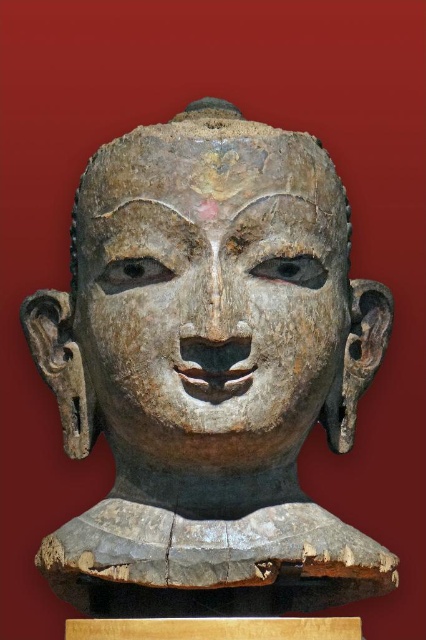
You are an art conservator examining the weathered wood head at center and the weathered wood face at center. Which object is taller?

The weathered wood head at center is taller than the weathered wood face at center.

You are an archaeologist examining the stone sculpture. You notice two points on its surface marked at coordinates point (117, 372) and point (250, 300). From your vantage point, which point is closer to you?

Point (250, 300) is closer to you because the description states that point (117, 372) is behind point (250, 300).